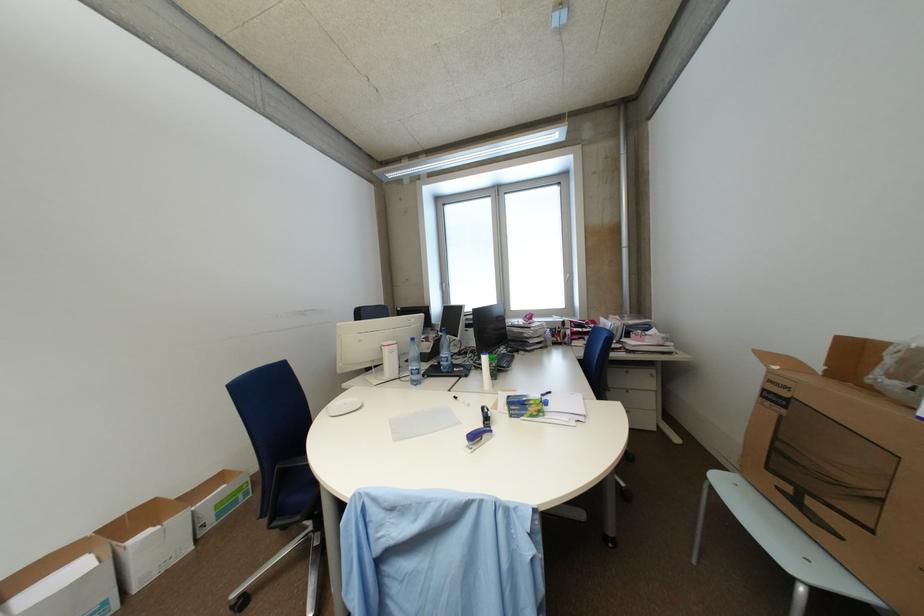
Where would you pull the drawer handle? Please return your answer as a coordinate pair (x, y).

(626, 371)